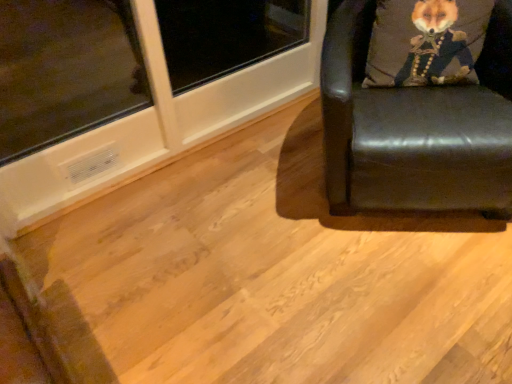
At what (x,y) coordinates should I click in order to perform the action: click on free point in front of black leather chair at right. Please return your answer as a coordinate pair (x, y). This screenshot has width=512, height=384. Looking at the image, I should click on (392, 301).